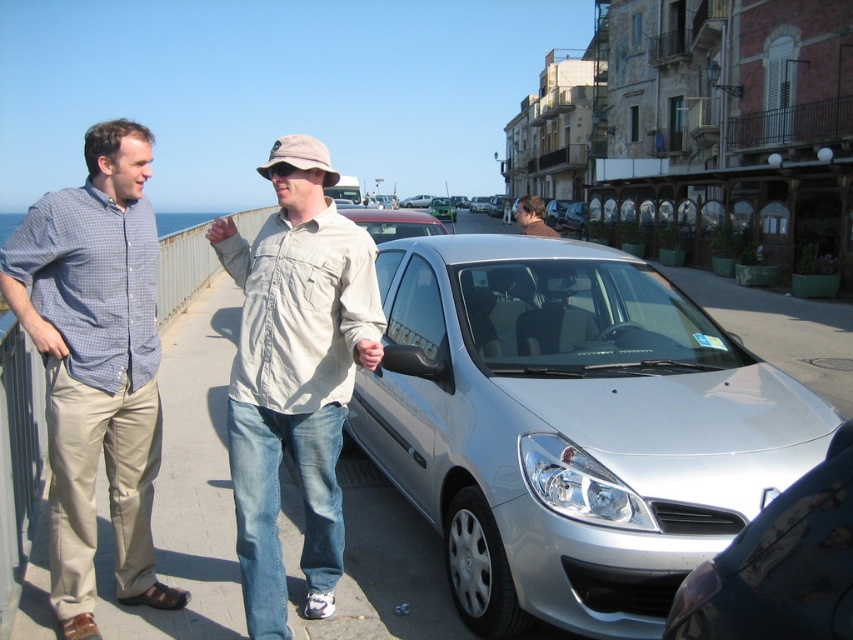
You are a photographer trying to capture a photo of the light beige cotton shirt at center without the silver metallic car at center blocking it. Is it possible to do so given their sizes?

The silver metallic car at center is smaller than the light beige cotton shirt at center, so the car is smaller and might not fully block the shirt. However, since both are at the center, adjusting the camera angle slightly could allow capturing the shirt without obstruction.

You are standing at the camera position and want to approach the satin silver sedan at center to retrieve your keys from the trunk. Considering the distance mentioned, can you reach the sedan without moving more than 5 feet?

The distance between you and the satin silver sedan at center is 4.29 feet, which is less than 5 feet. Therefore, you can reach the sedan without moving more than 5 feet.

You are standing on the sidewalk and see the satin silver sedan at center and the matte beige shirt at center. Which object is closer to the street?

The satin silver sedan at center is closer to the street because it is positioned to the left of the matte beige shirt at center, and the street is on the right side of the frame.